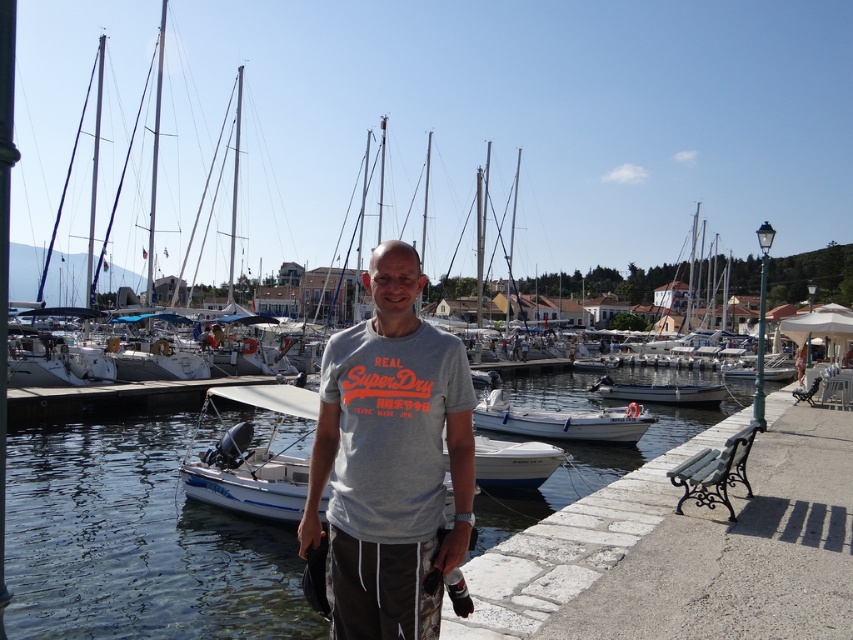
Question: Which of the following is the farthest from the observer?

Choices:
 (A) (289, 413)
 (B) (689, 396)
 (C) (381, 456)

Answer: (B)

Question: Considering the real-world distances, which object is closest to the white fiberglass boat at center?

Choices:
 (A) white matte boat at center
 (B) clear water at center

Answer: (B)

Question: Does white matte boat at center appear on the right side of white fiberglass boat at center?

Choices:
 (A) yes
 (B) no

Answer: (B)

Question: Can you confirm if gray cotton t-shirt at center is thinner than white plastic boat at lower center?

Choices:
 (A) no
 (B) yes

Answer: (B)

Question: From the image, what is the correct spatial relationship of clear water at center in relation to white matte boat at center?

Choices:
 (A) above
 (B) below

Answer: (B)

Question: Which point is closer to the camera taking this photo?

Choices:
 (A) (641, 392)
 (B) (276, 387)

Answer: (B)